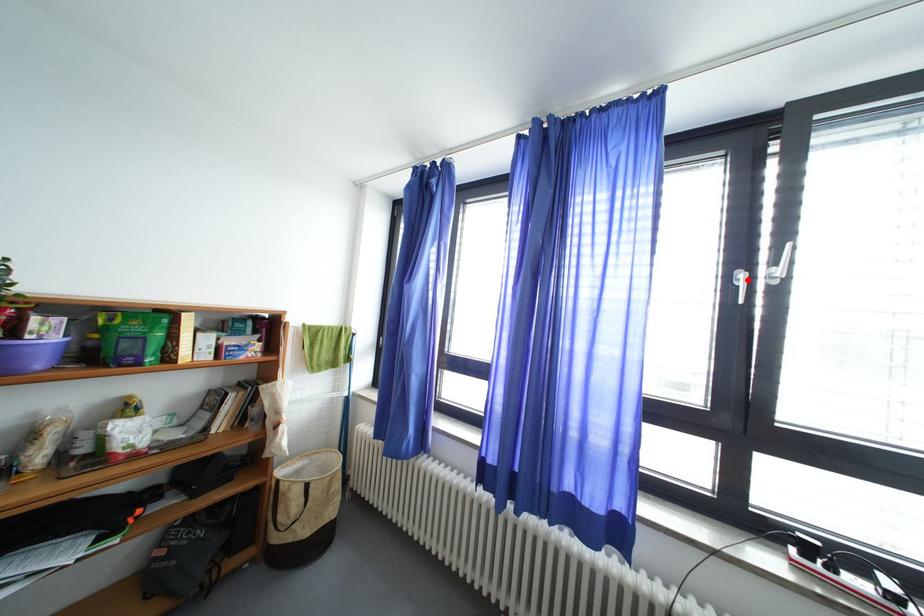
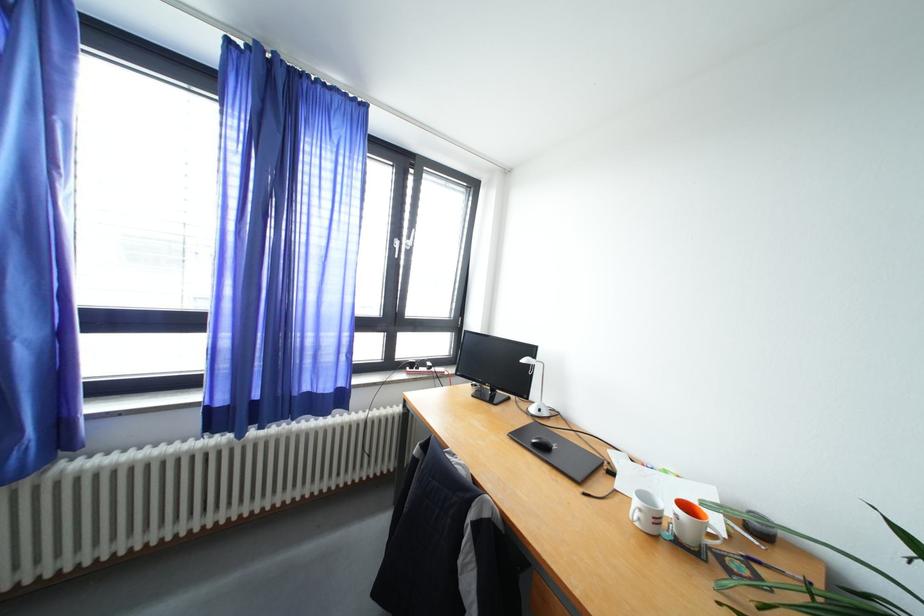
Locate, in the second image, the point that corresponds to the highlighted location in the first image.

(404, 246)